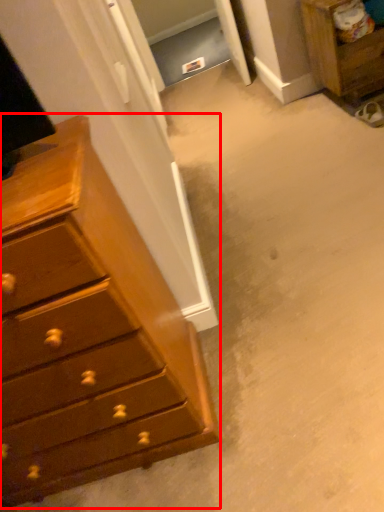
Question: From the image's perspective, considering the relative positions of chest of drawers (annotated by the red box) and nightstand in the image provided, where is chest of drawers (annotated by the red box) located with respect to the staircase?

Choices:
 (A) above
 (B) below

Answer: (B)